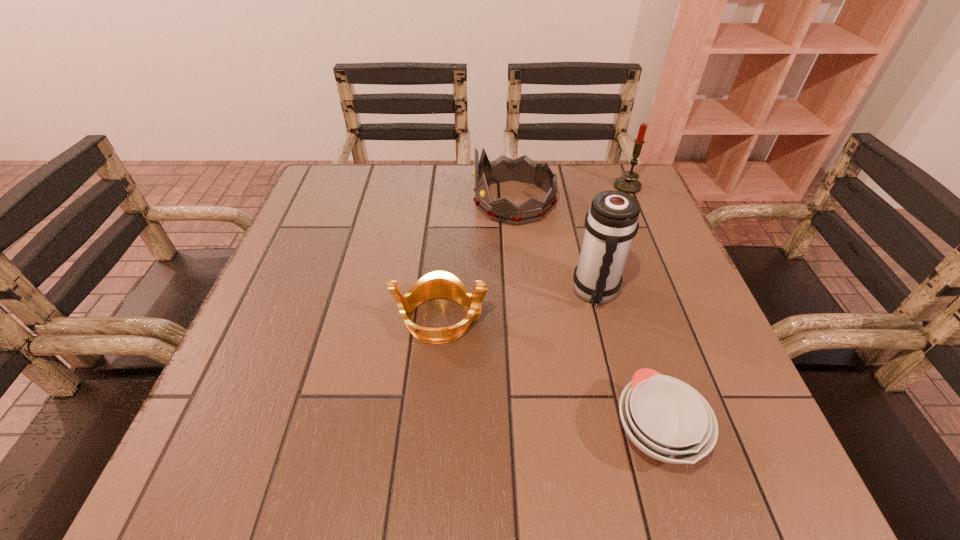
Identify the location of the tallest object. (611, 223).

At what (x,y) coordinates should I click in order to perform the action: click on the fourth shortest object. Please return your answer as a coordinate pair (x, y). Looking at the image, I should click on (628, 183).

Identify the location of the rightmost object. (628, 183).

This screenshot has height=540, width=960. Find the location of `the third tallest object`. the third tallest object is located at coordinates (523, 169).

Locate an element on the screen. the farther tiara is located at coordinates (523, 169).

Find the location of a particular element. The height and width of the screenshot is (540, 960). the nearer tiara is located at coordinates (438, 284).

Locate an element on the screen. Image resolution: width=960 pixels, height=540 pixels. the fourth tallest object is located at coordinates (x=438, y=284).

This screenshot has width=960, height=540. In order to click on the shortest object in this screenshot , I will do `click(667, 419)`.

This screenshot has width=960, height=540. What are the coordinates of `the nearest object` in the screenshot? It's located at (667, 419).

In order to click on free space located on the side with the handle of the thermos bottle in this screenshot , I will do `click(612, 356)`.